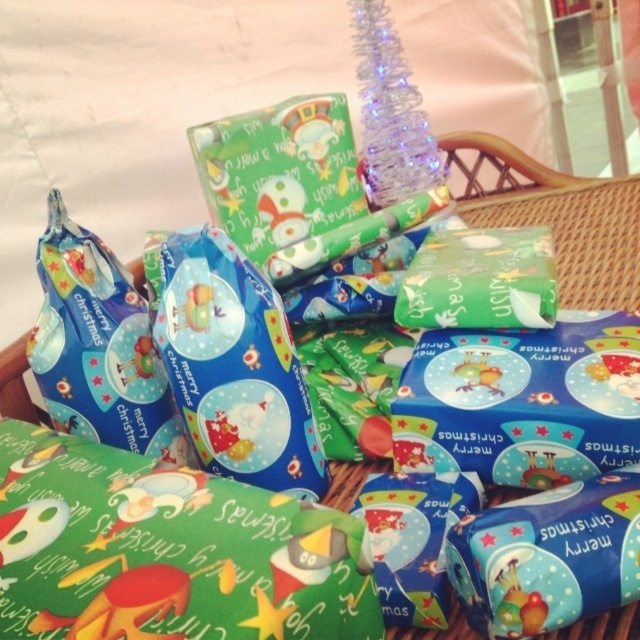
In the scene shown: Is blue glossy gift bag at left closer to camera compared to green paper gift at center?

Yes.

Is point (44, 339) positioned after point (570, 193)?

No, it is not.

At what (x,y) coordinates should I click in order to perform the action: click on blue glossy gift bag at left. Please return your answer as a coordinate pair (x, y). The width and height of the screenshot is (640, 640). Looking at the image, I should click on (99, 346).

Can you confirm if green shiny wrapping paper at lower left is positioned to the right of blue glossy gift bag at left?

Yes, green shiny wrapping paper at lower left is to the right of blue glossy gift bag at left.

Is point (276, 593) farther from camera compared to point (109, 316)?

No, it is in front of (109, 316).

Is point (237, 573) closer to camera compared to point (147, 412)?

Yes, it is in front of point (147, 412).

Find the location of a particular element. Image resolution: width=640 pixels, height=640 pixels. green shiny wrapping paper at lower left is located at coordinates pyautogui.click(x=166, y=552).

Between point (342, 636) and point (593, 212), which one is positioned in front?

Point (342, 636) is more forward.

Does green shiny wrapping paper at lower left come behind green paper gift at center?

No, it is in front of green paper gift at center.

Who is more distant from viewer, (x=182, y=586) or (x=336, y=477)?

Point (x=336, y=477)

Find the location of a particular element. This screenshot has width=640, height=640. green shiny wrapping paper at lower left is located at coordinates (166, 552).